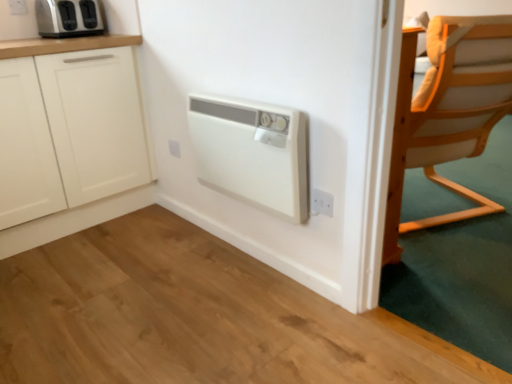
Question: Is satin silver toaster at upper left situated inside light wood chair at right or outside?

Choices:
 (A) outside
 (B) inside

Answer: (A)

Question: Based on their sizes in the image, would you say satin silver toaster at upper left is bigger or smaller than light wood chair at right?

Choices:
 (A) small
 (B) big

Answer: (A)

Question: Which object is positioned farthest from the white plastic heater at center?

Choices:
 (A) white plastic electric outlet at upper left, the third electric outlet ordered from the bottom
 (B) satin silver toaster at upper left
 (C) white plastic electric outlet at center, which is the 2th electric outlet in right-to-left order
 (D) light wood chair at right
 (E) white plastic electric outlet at lower right, acting as the 3th electric outlet starting from the top

Answer: (A)

Question: Based on their relative distances, which object is nearer to the white plastic electric outlet at center, the second electric outlet in the bottom-to-top sequence?

Choices:
 (A) white plastic heater at center
 (B) satin silver toaster at upper left
 (C) white plastic electric outlet at upper left, which ranks as the 1th electric outlet in back-to-front order
 (D) white matte cabinet at left
 (E) white plastic electric outlet at lower right, which ranks as the 1th electric outlet in front-to-back order

Answer: (D)